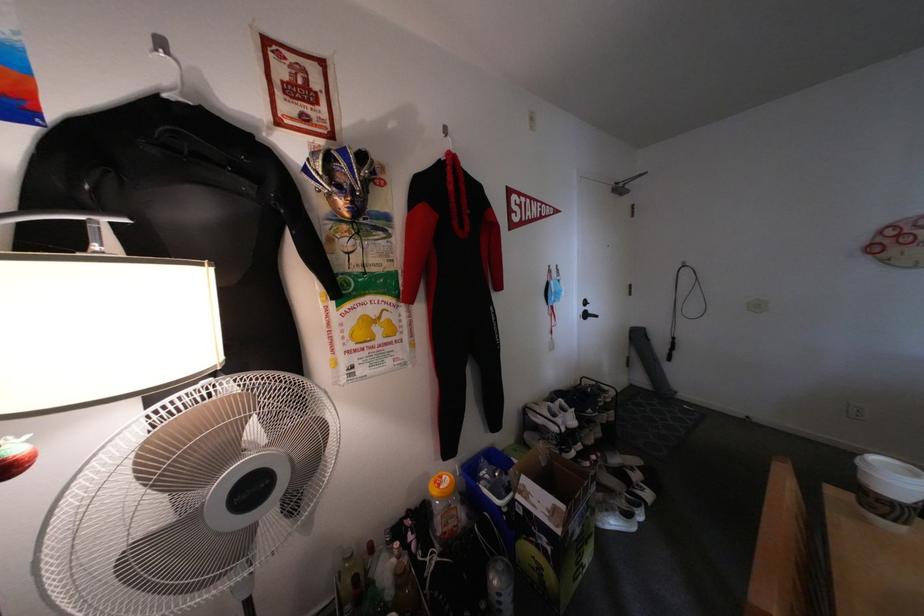
Where is `white paper cup`? white paper cup is located at coordinates (889, 490).